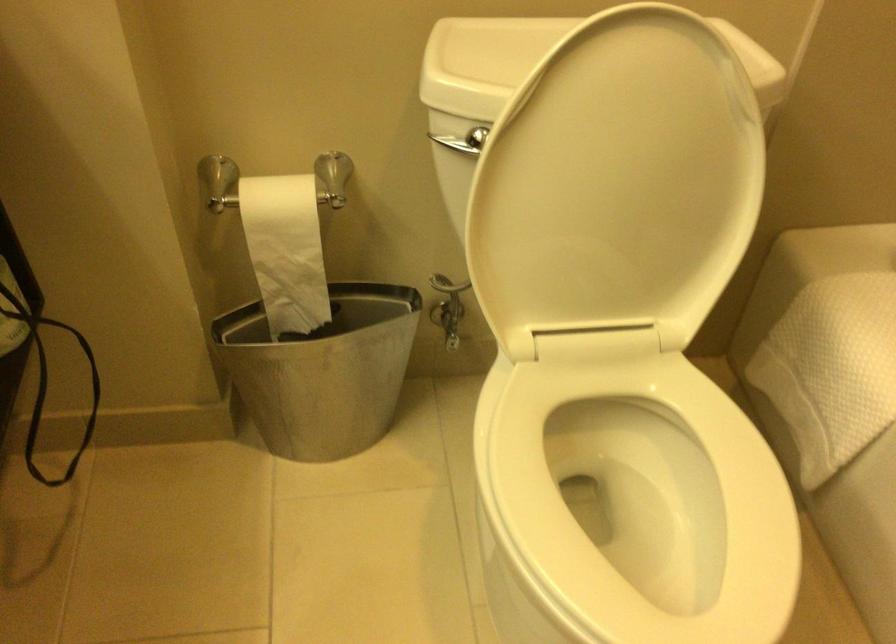
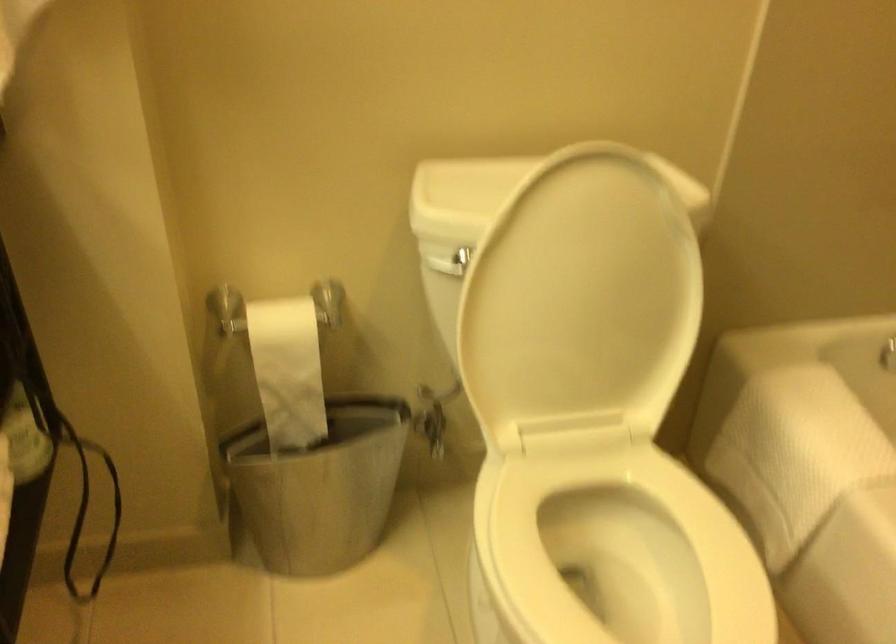
Find the pixel in the second image that matches pixel 286 248 in the first image.

(288, 370)